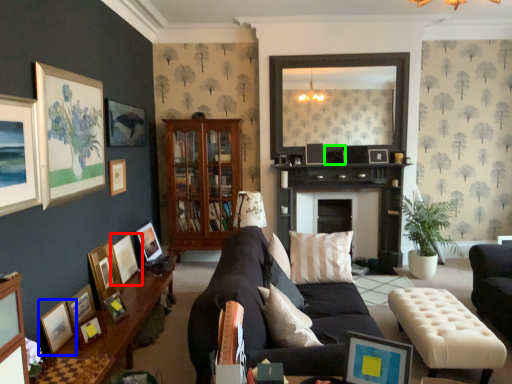
Question: Considering the real-world distances, which object is farthest from picture frame (highlighted by a red box)? picture frame (highlighted by a blue box) or picture frame (highlighted by a green box)?

Choices:
 (A) picture frame
 (B) picture frame

Answer: (B)